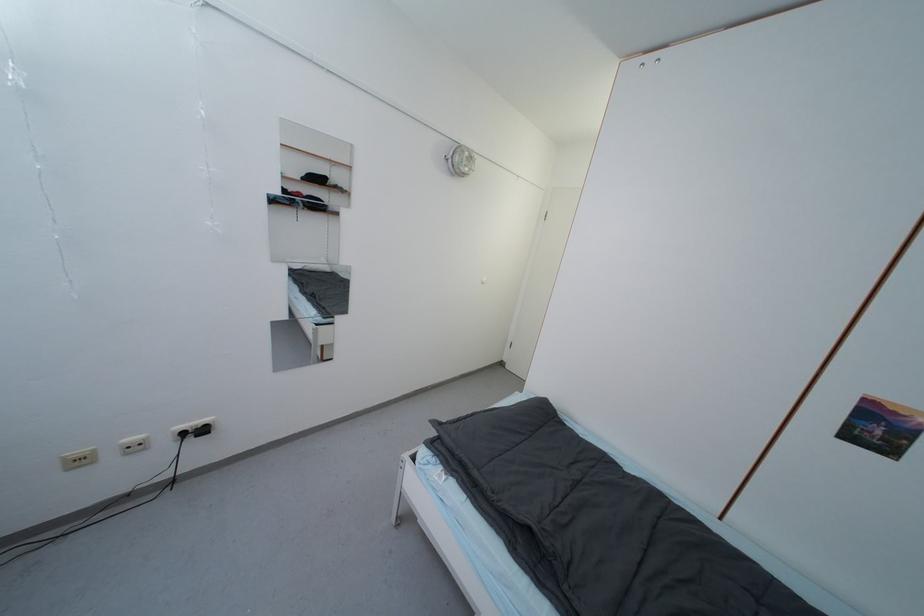
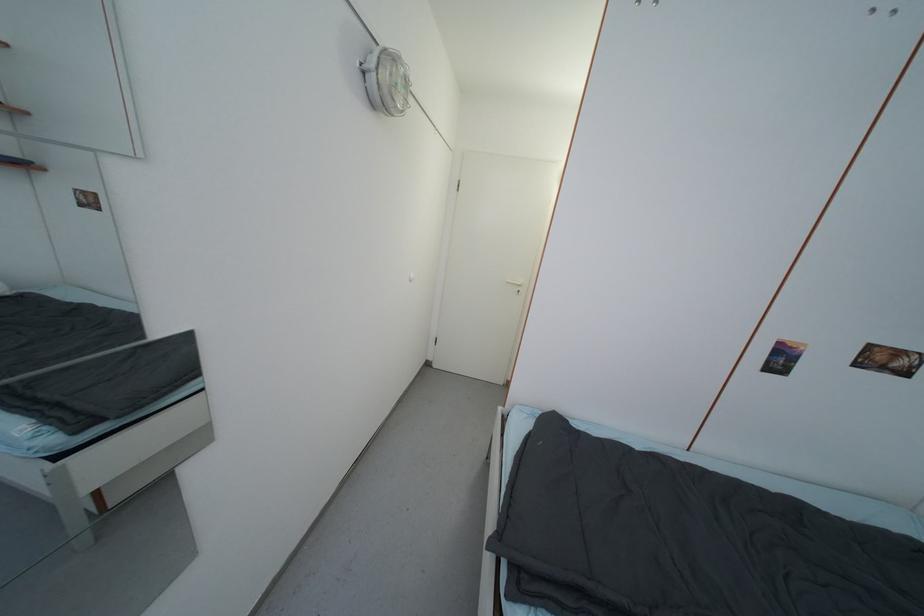
Question: The camera is either moving clockwise (left) or counter-clockwise (right) around the object. The first image is from the beginning of the video and the second image is from the end. Is the camera moving left or right when shooting the video?

Choices:
 (A) Left
 (B) Right

Answer: (A)